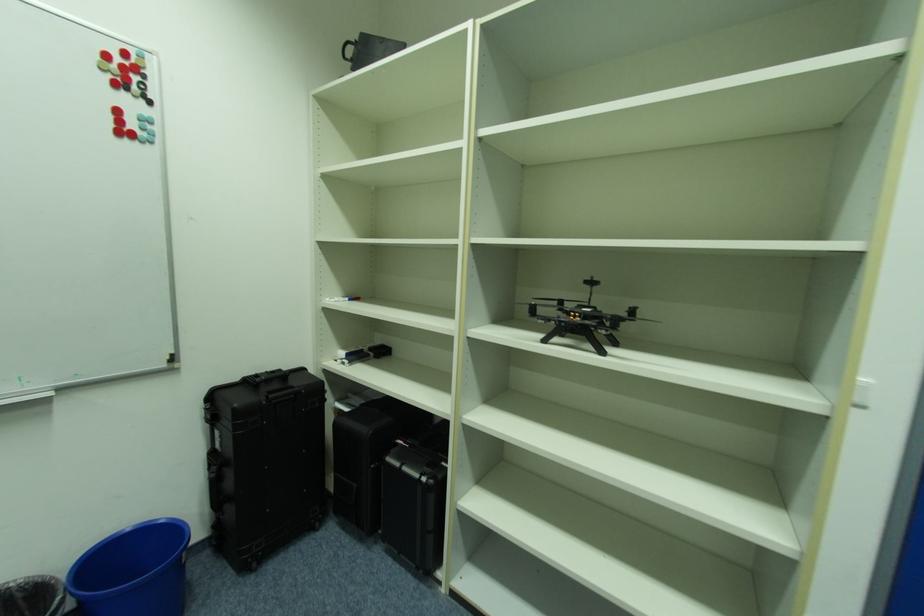
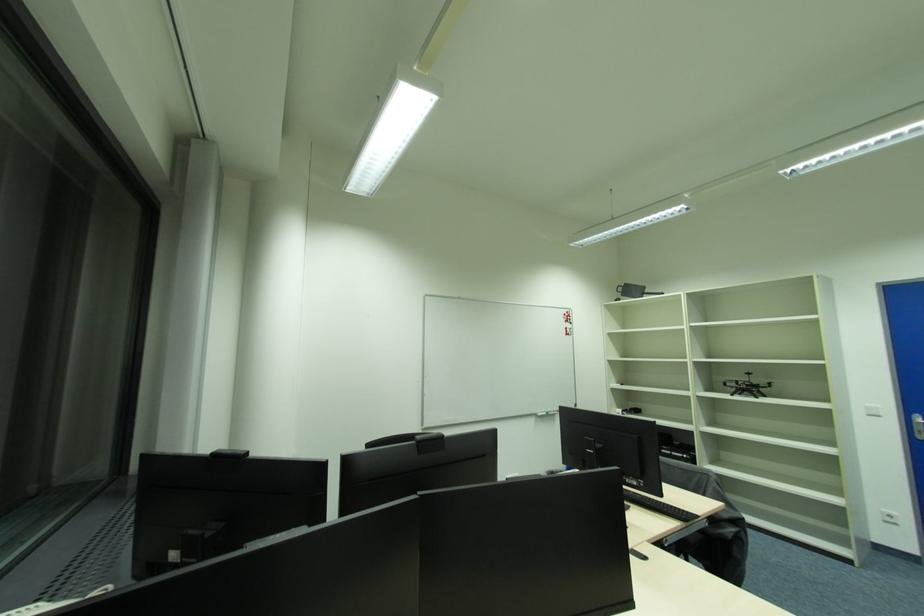
Question: In a continuous first-person perspective shot, in which direction is the camera moving?

Choices:
 (A) Left
 (B) Right
 (C) Forward
 (D) Backward

Answer: (D)